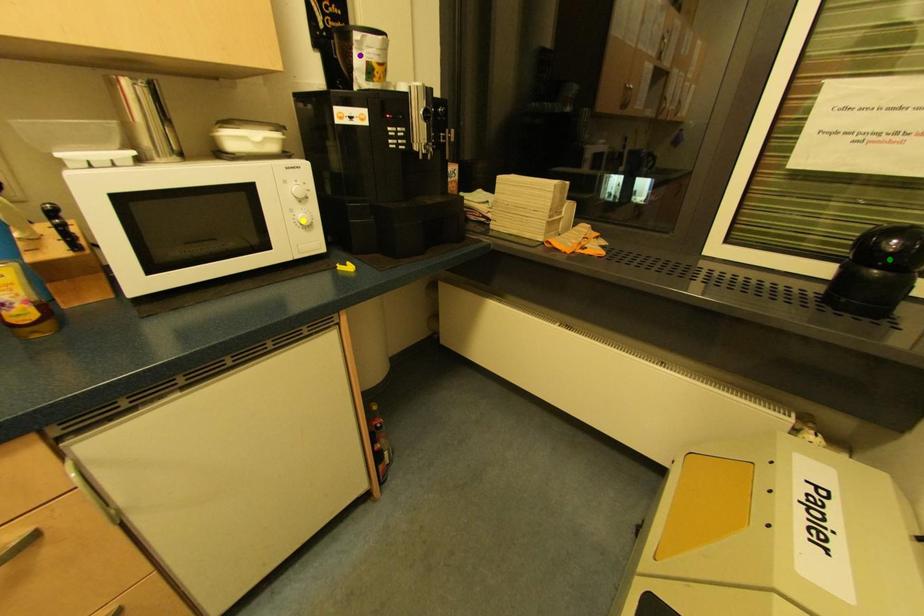
Order these from nearest to farthest:
1. purple point
2. green point
3. yellow point

green point → purple point → yellow point